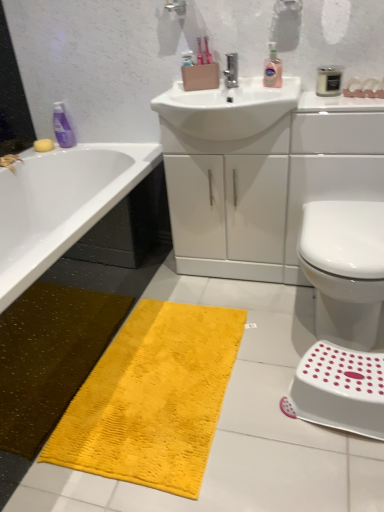
The image size is (384, 512). Find the location of `purple glossy mouthwash at upper left, the second mouthwash in the front-to-back sequence`. purple glossy mouthwash at upper left, the second mouthwash in the front-to-back sequence is located at coordinates (62, 127).

The image size is (384, 512). What do you see at coordinates (339, 390) in the screenshot? I see `white plastic step stool at lower right` at bounding box center [339, 390].

Find the location of `polished chrome tap at center`. polished chrome tap at center is located at coordinates (231, 70).

Can you tell me how much white plastic step stool at lower right and pink glossy liquid soap at upper center differ in facing direction?

They differ by 1.27 degrees in their facing directions.

Is the depth of white plastic step stool at lower right less than that of pink glossy liquid soap at upper center?

Yes, white plastic step stool at lower right is closer to the camera.

Which of these two, white plastic step stool at lower right or pink glossy liquid soap at upper center, is thinner?

pink glossy liquid soap at upper center.

Which of these two, white plastic step stool at lower right or pink glossy liquid soap at upper center, is smaller?

Smaller between the two is pink glossy liquid soap at upper center.

From a real-world perspective, is purple glossy mouthwash at upper left, arranged as the 1th mouthwash when viewed from the left, over white matte jar at upper right, marked as the 2th mouthwash in a back-to-front arrangement?

No, from a real-world perspective, purple glossy mouthwash at upper left, arranged as the 1th mouthwash when viewed from the left, is not on top of white matte jar at upper right, marked as the 2th mouthwash in a back-to-front arrangement.

What's the angular difference between purple glossy mouthwash at upper left, placed as the 1th mouthwash when sorted from back to front, and white matte jar at upper right, which appears as the 1th mouthwash when viewed from the right,'s facing directions?

The angular difference between purple glossy mouthwash at upper left, placed as the 1th mouthwash when sorted from back to front, and white matte jar at upper right, which appears as the 1th mouthwash when viewed from the right, is 1.15 degrees.

Is purple glossy mouthwash at upper left, the second mouthwash in the front-to-back sequence, located outside white matte jar at upper right, which is the 2th mouthwash from left to right?

Yes, purple glossy mouthwash at upper left, the second mouthwash in the front-to-back sequence, is located beyond the bounds of white matte jar at upper right, which is the 2th mouthwash from left to right.

Which point is more forward, (x=61, y=126) or (x=334, y=75)?

The point (x=334, y=75) is more forward.

How distant is pink glossy liquid soap at upper center from yellow plush bath mat at lower center?

pink glossy liquid soap at upper center is 1.25 meters from yellow plush bath mat at lower center.

Can you confirm if pink glossy liquid soap at upper center is shorter than yellow plush bath mat at lower center?

Incorrect, the height of pink glossy liquid soap at upper center does not fall short of that of yellow plush bath mat at lower center.

Which is in front, point (273, 66) or point (75, 429)?

Positioned in front is point (75, 429).

Which object is more forward, pink glossy liquid soap at upper center or yellow plush bath mat at lower center?

yellow plush bath mat at lower center is closer to the camera.

Which point is more forward, (x=286, y=255) or (x=343, y=323)?

The point (x=343, y=323) is in front.

In the scene shown: Which of these two, white glossy sink at center or white glossy bidet at lower right, is smaller?

Smaller between the two is white glossy bidet at lower right.

From a real-world perspective, is white glossy sink at center physically located above or below white glossy bidet at lower right?

In terms of real-world spatial position, white glossy sink at center is above white glossy bidet at lower right.

Visually, is white glossy sink at center positioned to the left or to the right of white glossy bidet at lower right?

white glossy sink at center is positioned on white glossy bidet at lower right's left side.

Which is more to the right, white matte jar at upper right, marked as the 2th mouthwash in a back-to-front arrangement, or pink glossy liquid soap at upper center?

white matte jar at upper right, marked as the 2th mouthwash in a back-to-front arrangement.

Considering the relative sizes of white matte jar at upper right, the first mouthwash from the front, and pink glossy liquid soap at upper center in the image provided, is white matte jar at upper right, the first mouthwash from the front, wider than pink glossy liquid soap at upper center?

No, white matte jar at upper right, the first mouthwash from the front, is not wider than pink glossy liquid soap at upper center.

From a real-world perspective, does white matte jar at upper right, marked as the 2th mouthwash in a back-to-front arrangement, stand above pink glossy liquid soap at upper center?

No, from a real-world perspective, white matte jar at upper right, marked as the 2th mouthwash in a back-to-front arrangement, is not above pink glossy liquid soap at upper center.

Is the position of white matte jar at upper right, the first mouthwash from the front, more distant than that of pink glossy liquid soap at upper center?

No, white matte jar at upper right, the first mouthwash from the front, is closer to the viewer.

How distant is yellow plush bath mat at lower center from white matte jar at upper right, which is the 2th mouthwash from left to right?

4.03 feet.

Are yellow plush bath mat at lower center and white matte jar at upper right, marked as the 2th mouthwash in a back-to-front arrangement, making contact?

No, yellow plush bath mat at lower center is not next to white matte jar at upper right, marked as the 2th mouthwash in a back-to-front arrangement.

Can you confirm if yellow plush bath mat at lower center is taller than white matte jar at upper right, marked as the 2th mouthwash in a back-to-front arrangement?

Incorrect, the height of yellow plush bath mat at lower center is not larger of that of white matte jar at upper right, marked as the 2th mouthwash in a back-to-front arrangement.

Based on the photo, considering the positions of objects yellow plush bath mat at lower center and white matte jar at upper right, which is the 2th mouthwash from left to right, in the image provided, who is behind, yellow plush bath mat at lower center or white matte jar at upper right, which is the 2th mouthwash from left to right,?

white matte jar at upper right, which is the 2th mouthwash from left to right, is behind.

Can you confirm if pink glossy liquid soap at upper center is bigger than white glossy sink at center?

Incorrect, pink glossy liquid soap at upper center is not larger than white glossy sink at center.

Would you say pink glossy liquid soap at upper center is to the left or to the right of white glossy sink at center in the picture?

In the image, pink glossy liquid soap at upper center appears on the left side of white glossy sink at center.

Can we say pink glossy liquid soap at upper center lies outside white glossy sink at center?

Yes, pink glossy liquid soap at upper center is not within white glossy sink at center.

Between point (264, 66) and point (206, 124), which one is positioned in front?

Positioned in front is point (206, 124).

At what (x,y) coordinates should I click in order to perform the action: click on cleaning product located on the left of white plastic step stool at lower right. Please return your answer as a coordinate pair (x, y). Looking at the image, I should click on (272, 69).

The width and height of the screenshot is (384, 512). Find the location of `mouthwash that appears above the purple glossy mouthwash at upper left, which is counted as the second mouthwash, starting from the right (from a real-world perspective)`. mouthwash that appears above the purple glossy mouthwash at upper left, which is counted as the second mouthwash, starting from the right (from a real-world perspective) is located at coordinates (329, 80).

In the scene shown: From the image, which object appears to be nearer to white glossy bidet at lower right, pink glossy liquid soap at upper center or yellow plush bath mat at lower center?

The object closer to white glossy bidet at lower right is yellow plush bath mat at lower center.

Estimate the real-world distances between objects in this image. Which object is closer to purple glossy mouthwash at upper left, placed as the 1th mouthwash when sorted from back to front, white plastic step stool at lower right or white matte jar at upper right, the first mouthwash from the front?

white matte jar at upper right, the first mouthwash from the front, is positioned closer to the anchor purple glossy mouthwash at upper left, placed as the 1th mouthwash when sorted from back to front.

Based on their spatial positions, is yellow plush bath mat at lower center or white glossy sink at center closer to white glossy bidet at lower right?

white glossy sink at center is positioned closer to the anchor white glossy bidet at lower right.

Looking at this image, looking at the image, which one is located closer to white glossy sink at center, yellow sponge at upper left or yellow plush bath mat at lower center?

yellow plush bath mat at lower center.

Based on their spatial positions, is yellow sponge at upper left or yellow plush bath mat at lower center further from white matte jar at upper right, which is the 2th mouthwash from left to right?

yellow sponge at upper left.

In the scene shown: When comparing their distances from polished chrome tap at center, does purple glossy mouthwash at upper left, the second mouthwash in the front-to-back sequence, or yellow sponge at upper left seem closer?

The object closer to polished chrome tap at center is purple glossy mouthwash at upper left, the second mouthwash in the front-to-back sequence.

Looking at the image, which one is located closer to polished chrome tap at center, purple glossy mouthwash at upper left, which is counted as the second mouthwash, starting from the right, or white plastic step stool at lower right?

purple glossy mouthwash at upper left, which is counted as the second mouthwash, starting from the right.

Which object lies nearer to the anchor point white glossy sink at center, yellow sponge at upper left or polished chrome tap at center?

Based on the image, polished chrome tap at center appears to be nearer to white glossy sink at center.

Where is `counter top that lies between white glossy sink at center and white glossy bidet at lower right from top to bottom`? The image size is (384, 512). counter top that lies between white glossy sink at center and white glossy bidet at lower right from top to bottom is located at coordinates (260, 173).

The width and height of the screenshot is (384, 512). What are the coordinates of `counter top situated between purple glossy mouthwash at upper left, placed as the 1th mouthwash when sorted from back to front, and white matte jar at upper right, marked as the 2th mouthwash in a back-to-front arrangement, from left to right` in the screenshot? It's located at (260, 173).

At what (x,y) coordinates should I click in order to perform the action: click on sink between purple glossy mouthwash at upper left, placed as the 1th mouthwash when sorted from back to front, and white plastic step stool at lower right in the up-down direction. Please return your answer as a coordinate pair (x, y). This screenshot has height=512, width=384. Looking at the image, I should click on pyautogui.click(x=227, y=108).

The height and width of the screenshot is (512, 384). Find the location of `mouthwash situated between yellow sponge at upper left and polished chrome tap at center from left to right`. mouthwash situated between yellow sponge at upper left and polished chrome tap at center from left to right is located at coordinates (62, 127).